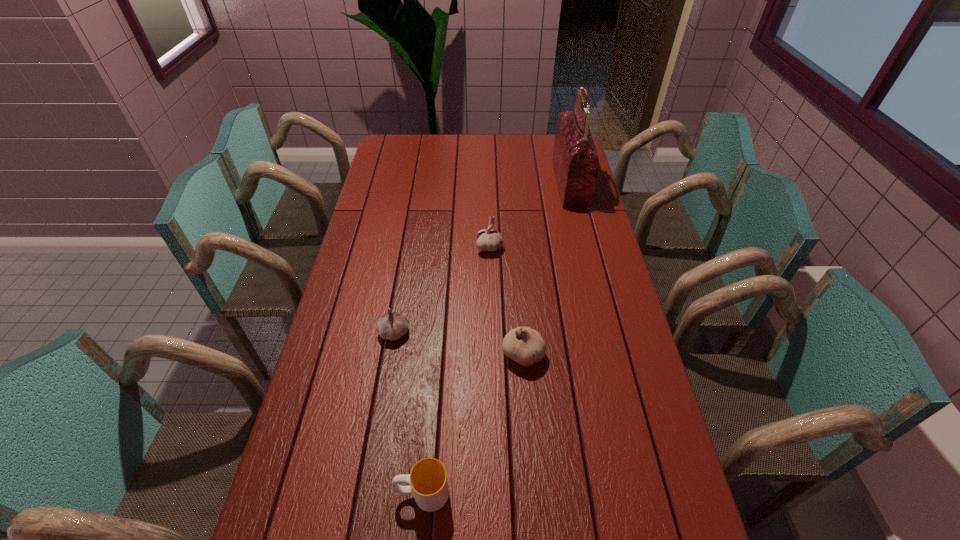
Where is `vacant space at the right edge of the desktop`? vacant space at the right edge of the desktop is located at coordinates (616, 425).

Find the location of `free point between the farthest garlic and the handbag`. free point between the farthest garlic and the handbag is located at coordinates (530, 215).

Find the location of a particular element. The width and height of the screenshot is (960, 540). empty space between the leftmost object and the farthest garlic is located at coordinates (442, 290).

At what (x,y) coordinates should I click in order to perform the action: click on vacant area between the farthest object and the cup. Please return your answer as a coordinate pair (x, y). The width and height of the screenshot is (960, 540). Looking at the image, I should click on click(496, 338).

At what (x,y) coordinates should I click in order to perform the action: click on vacant space that's between the fourth object from right to left and the leftmost garlic. Please return your answer as a coordinate pair (x, y). The image size is (960, 540). Looking at the image, I should click on (408, 413).

Where is `vacant point located between the nearest object and the second farthest object`? vacant point located between the nearest object and the second farthest object is located at coordinates (456, 370).

Where is `vacant space that's between the fourth nearest object and the leftmost garlic`? vacant space that's between the fourth nearest object and the leftmost garlic is located at coordinates (442, 290).

This screenshot has width=960, height=540. I want to click on vacant area between the leftmost object and the fourth nearest object, so (442, 290).

Select which object appears as the third closest to the farthest object. Please provide its 2D coordinates. Your answer should be formatted as a tuple, i.e. [(x, y)], where the tuple contains the x and y coordinates of a point satisfying the conditions above.

[(392, 326)]

I want to click on the second closest object to the farthest object, so click(x=524, y=345).